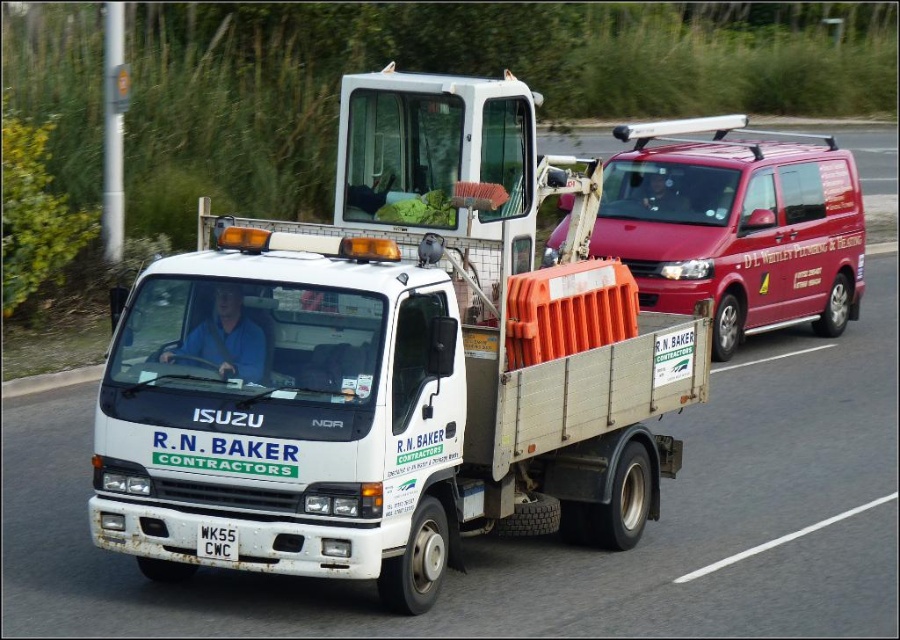
You are a traffic officer assessing the scene. You notice the metallic red van at right and the white plastic license plate at lower center. Which object is wider in this image?

The metallic red van at right is wider than the white plastic license plate at lower center according to the description.

You are a pedestrian standing at the side of the road. You see the metallic red van at right and the white plastic license plate at lower center. Which object is taller?

The metallic red van at right is much taller than the white plastic license plate at lower center.